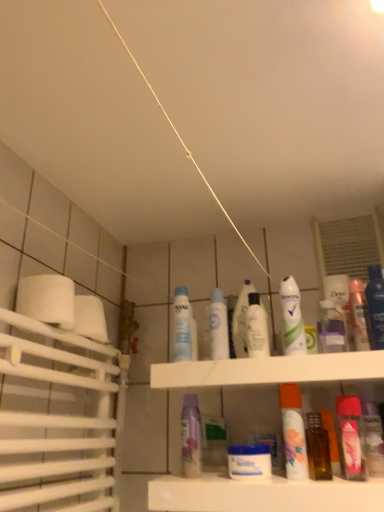
Question: Does white glossy mouthwash at center, the fifth mouthwash in the left-to-right sequence, have a smaller size compared to transparent plastic mouthwash at center, the first mouthwash viewed from the left?

Choices:
 (A) no
 (B) yes

Answer: (A)

Question: Is white glossy mouthwash at center, which appears as the fifth mouthwash when viewed from the right, located outside transparent plastic mouthwash at center, which is the 9th mouthwash in right-to-left order?

Choices:
 (A) yes
 (B) no

Answer: (A)

Question: Considering the relative sizes of white glossy mouthwash at center, which appears as the fifth mouthwash when viewed from the right, and transparent plastic mouthwash at center, which is the 9th mouthwash in right-to-left order, in the image provided, is white glossy mouthwash at center, which appears as the fifth mouthwash when viewed from the right, bigger than transparent plastic mouthwash at center, which is the 9th mouthwash in right-to-left order,?

Choices:
 (A) yes
 (B) no

Answer: (A)

Question: Is white glossy mouthwash at center, which appears as the fifth mouthwash when viewed from the right, with transparent plastic mouthwash at center, which is the 9th mouthwash in right-to-left order?

Choices:
 (A) yes
 (B) no

Answer: (B)

Question: From the image's perspective, is white glossy mouthwash at center, which appears as the fifth mouthwash when viewed from the right, on top of transparent plastic mouthwash at center, the first mouthwash viewed from the left?

Choices:
 (A) yes
 (B) no

Answer: (B)

Question: From the image's perspective, is translucent orange spray can at center, placed as the fourth mouthwash when sorted from right to left, located above or below white glossy jar at center, which ranks as the 6th mouthwash in right-to-left order?

Choices:
 (A) above
 (B) below

Answer: (A)

Question: Does point (279, 398) appear closer or farther from the camera than point (269, 478)?

Choices:
 (A) farther
 (B) closer

Answer: (A)

Question: Do you think translucent orange spray can at center, acting as the 6th mouthwash starting from the left, is within white glossy jar at center, arranged as the fourth mouthwash when viewed from the left, or outside of it?

Choices:
 (A) outside
 (B) inside

Answer: (A)

Question: In terms of width, does translucent orange spray can at center, placed as the fourth mouthwash when sorted from right to left, look wider or thinner when compared to white glossy jar at center, arranged as the fourth mouthwash when viewed from the left?

Choices:
 (A) wide
 (B) thin

Answer: (B)

Question: From the image's perspective, is white glossy jar at center, arranged as the fourth mouthwash when viewed from the left, above or below transparent plastic mouthwash at center, which is the 9th mouthwash in right-to-left order?

Choices:
 (A) below
 (B) above

Answer: (A)

Question: Based on their sizes in the image, would you say white glossy jar at center, arranged as the fourth mouthwash when viewed from the left, is bigger or smaller than transparent plastic mouthwash at center, which is the 9th mouthwash in right-to-left order?

Choices:
 (A) big
 (B) small

Answer: (A)

Question: Visually, is white glossy jar at center, which ranks as the 6th mouthwash in right-to-left order, positioned to the left or to the right of transparent plastic mouthwash at center, the first mouthwash viewed from the left?

Choices:
 (A) right
 (B) left

Answer: (A)

Question: From a real-world perspective, is white glossy jar at center, which ranks as the 6th mouthwash in right-to-left order, above or below transparent plastic mouthwash at center, the first mouthwash viewed from the left?

Choices:
 (A) above
 (B) below

Answer: (B)

Question: In terms of size, does translucent plastic spray bottle at upper center appear bigger or smaller than purple matte mouthwash at center, the 8th mouthwash from the right?

Choices:
 (A) big
 (B) small

Answer: (B)

Question: Considering the relative positions of translucent plastic spray bottle at upper center and purple matte mouthwash at center, the 8th mouthwash from the right, in the image provided, is translucent plastic spray bottle at upper center to the left or to the right of purple matte mouthwash at center, the 8th mouthwash from the right,?

Choices:
 (A) left
 (B) right

Answer: (B)